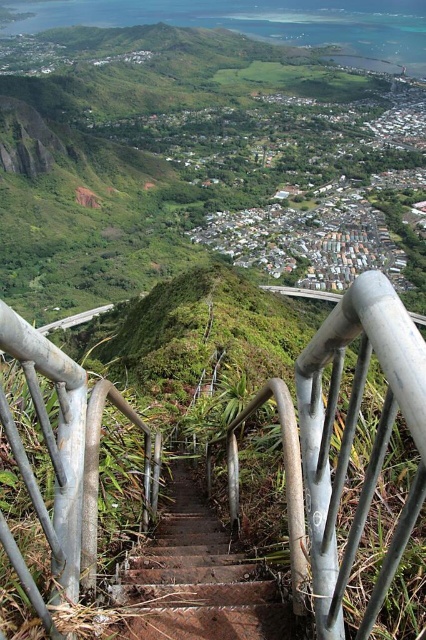
Question: Which point is closer to the camera?

Choices:
 (A) silver metallic rail at center
 (B) rusty metal stairs at center

Answer: (A)

Question: Is silver metallic rail at center wider than rusty metal stairs at center?

Choices:
 (A) no
 (B) yes

Answer: (B)

Question: Where is silver metallic rail at center located in relation to rusty metal stairs at center in the image?

Choices:
 (A) below
 (B) above

Answer: (B)

Question: Which point is farther from the camera taking this photo?

Choices:
 (A) (247, 605)
 (B) (287, 392)

Answer: (B)

Question: Which point appears closest to the camera in this image?

Choices:
 (A) click(192, 492)
 (B) click(270, 385)

Answer: (B)

Question: Is silver metallic rail at center positioned before rusty metal stairs at center?

Choices:
 (A) no
 (B) yes

Answer: (B)